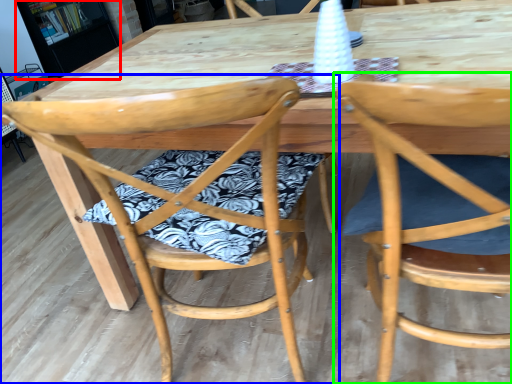
Question: Which object is the farthest from bookshelf (highlighted by a red box)? Choose among these: chair (highlighted by a blue box) or chair (highlighted by a green box).

Choices:
 (A) chair
 (B) chair

Answer: (B)